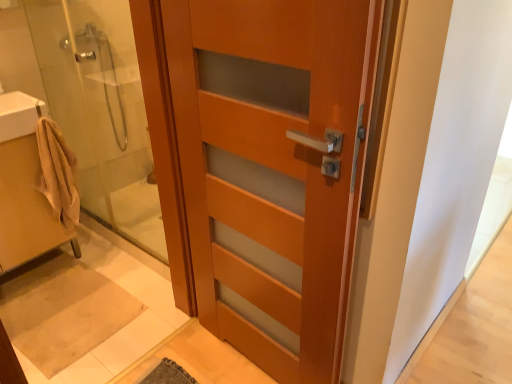
Question: Is matte wood door at center inside or outside of beige cotton bathrobe at left?

Choices:
 (A) inside
 (B) outside

Answer: (B)

Question: From a real-world perspective, relative to beige cotton bathrobe at left, is matte wood door at center vertically above or below?

Choices:
 (A) above
 (B) below

Answer: (A)

Question: Considering the real-world distances, which object is closest to the white glossy sink at upper left, which is the second sink in bottom-to-top order?

Choices:
 (A) matte wood door at center
 (B) beige fabric towel at left, arranged as the first sink when ordered from the bottom
 (C) beige cotton bathrobe at left
 (D) matte wood door at center

Answer: (C)

Question: Based on their relative distances, which object is farther from the matte wood door at center?

Choices:
 (A) white glossy sink at upper left, which is the second sink in bottom-to-top order
 (B) beige fabric towel at left, arranged as the first sink when ordered from the bottom
 (C) matte wood door at center
 (D) beige cotton bathrobe at left

Answer: (C)